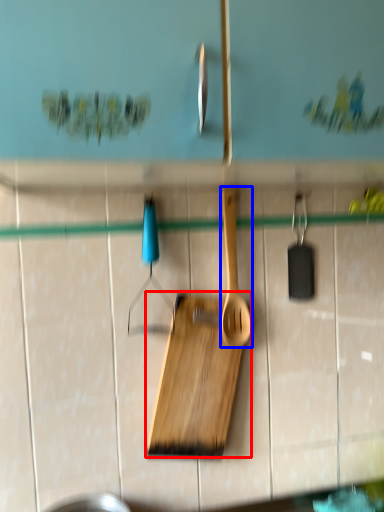
Question: Which point is closer to the camera, cutting board (highlighted by a red box) or spatula (highlighted by a blue box)?

Choices:
 (A) cutting board
 (B) spatula

Answer: (A)